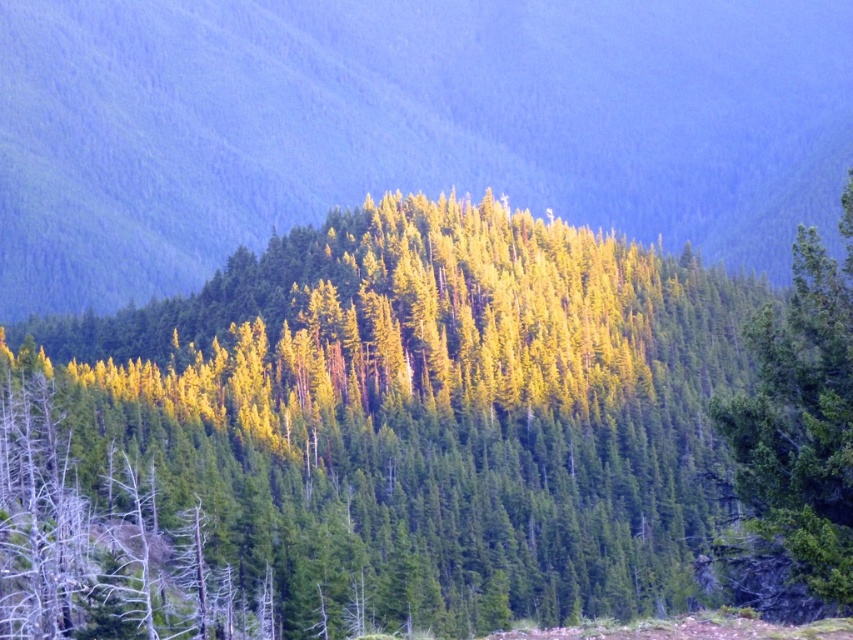
Is yellow-green foliage at center bigger than green matte tree at right?

Correct, yellow-green foliage at center is larger in size than green matte tree at right.

Which is behind, point (653, 474) or point (821, 429)?

Positioned behind is point (653, 474).

Locate an element on the screen. The width and height of the screenshot is (853, 640). yellow-green foliage at center is located at coordinates (427, 436).

Between point (764, 394) and point (115, 124), which one is positioned in front?

Positioned in front is point (764, 394).

Between yellow-green foliage at center and green textured forest at center, which one appears on the left side from the viewer's perspective?

yellow-green foliage at center is more to the left.

Identify the location of yellow-green foliage at center. The image size is (853, 640). (427, 436).

The width and height of the screenshot is (853, 640). In order to click on yellow-green foliage at center in this screenshot , I will do `click(427, 436)`.

Which is below, green textured forest at center or green matte tree at right?

Positioned lower is green matte tree at right.

Is point (173, 285) farther from camera compared to point (848, 432)?

Yes, point (173, 285) is behind point (848, 432).

At what (x,y) coordinates should I click in order to perform the action: click on green textured forest at center. Please return your answer as a coordinate pair (x, y). Looking at the image, I should click on (403, 125).